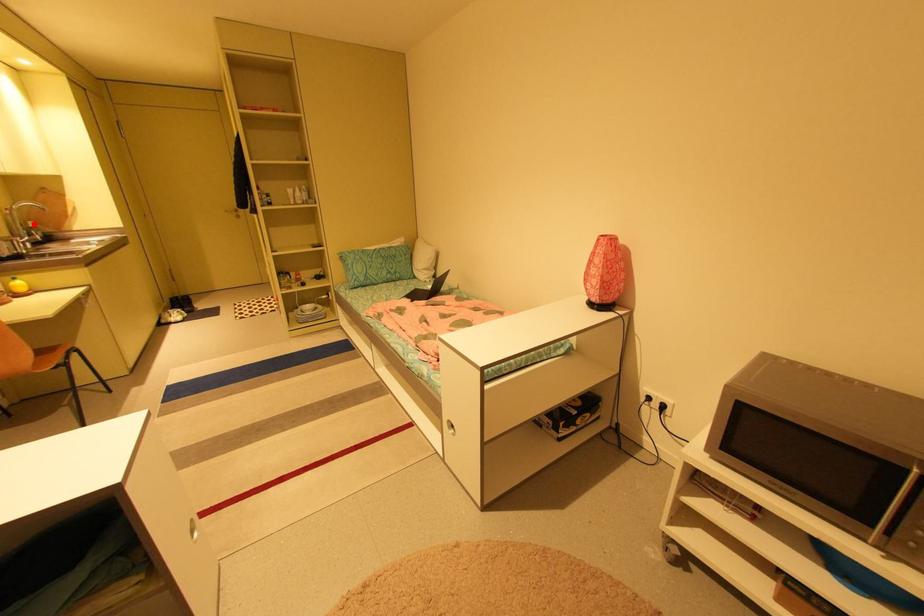
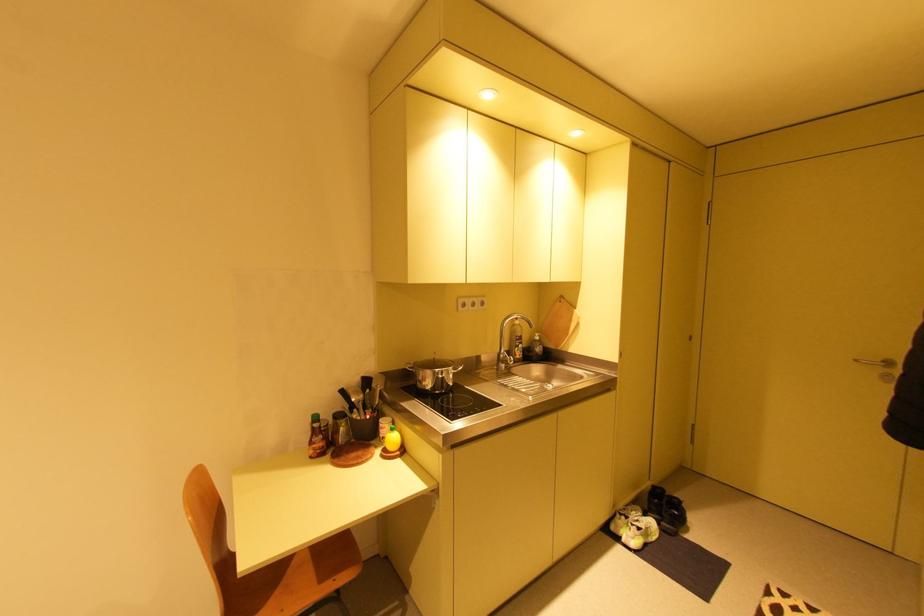
Question: A red point is marked in image1. In image2, is the corresponding 3D point closer to the camera or farther? Reply with the corresponding letter.

Choices:
 (A) The corresponding 3D point is closer.
 (B) The corresponding 3D point is farther.

Answer: (A)